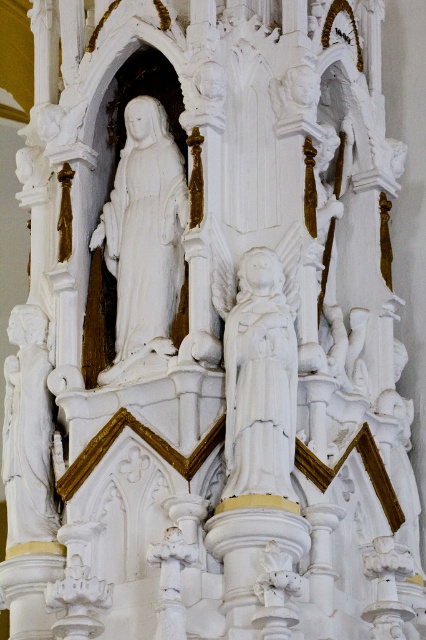
You are an art student analyzing the religious sculpture. You notice two statues, the white marble statue at center and the white stone statue at left. Which one is positioned to the right of the other?

The white marble statue at center is to the right of the white stone statue at left according to the description.

You are an art conservator examining the religious sculpture. You need to assess the positioning of the white marble statue at upper left. Based on its coordinates, is it closer to the top edge or the left edge of the sculpture?

The white marble statue at upper left is located at point coordinates where the x and y values are both less than 0.5, indicating it is closer to the top edge and left edge. However, since the question specifically asks between top and left edges, the coordinates suggest it is equidistant if x and y are similar. But given typical coordinate systems, the y coordinate relates to vertical position. Here, y is 0.34, so it is 34.0 from the bottom? Wait, maybe the coordinate system is normalized from top left as

What is the color and material of the statue located at point (144, 236) in the image?

The statue at point (144, 236) is white and made of marble.